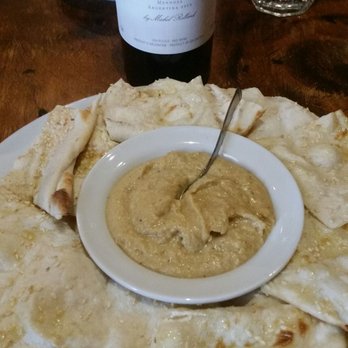
Image resolution: width=348 pixels, height=348 pixels. I want to click on white bowl, so click(x=266, y=282).